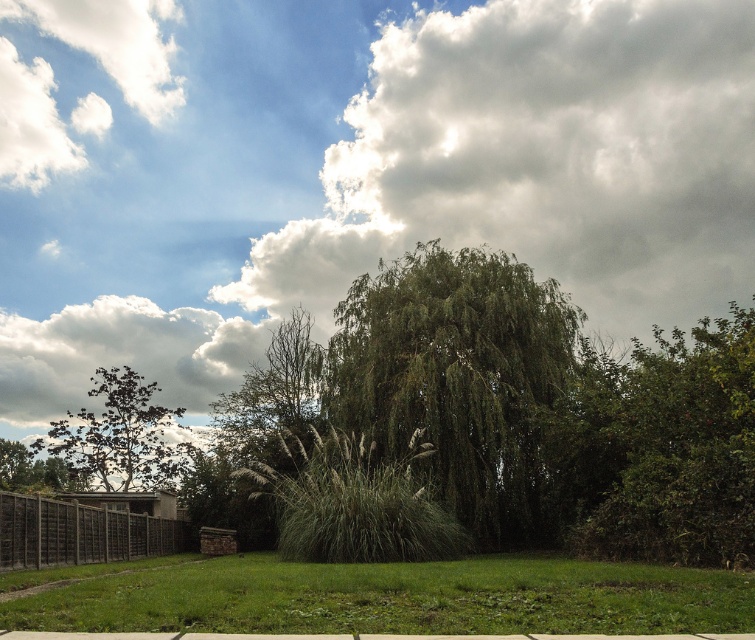
Can you confirm if cloudy sky at upper center is bigger than wooden fence at lower left?

Correct, cloudy sky at upper center is larger in size than wooden fence at lower left.

The image size is (755, 640). I want to click on cloudy sky at upper center, so click(x=353, y=172).

Find the location of a particular element. The height and width of the screenshot is (640, 755). cloudy sky at upper center is located at coordinates (353, 172).

Where is `cloudy sky at upper center`? cloudy sky at upper center is located at coordinates (353, 172).

Looking at this image, between cloudy sky at upper center and green leafy bush at right, which one appears on the right side from the viewer's perspective?

Positioned to the right is green leafy bush at right.

In the scene shown: Who is more distant from viewer, (x=544, y=163) or (x=612, y=531)?

Point (x=544, y=163)

The image size is (755, 640). I want to click on cloudy sky at upper center, so click(x=353, y=172).

Between cloudy sky at upper center and green leafy tree at left, which one appears on the right side from the viewer's perspective?

cloudy sky at upper center

Between cloudy sky at upper center and green leafy tree at left, which one is positioned higher?

cloudy sky at upper center is above.

Looking at this image, who is more distant from viewer, (x=162, y=154) or (x=156, y=481)?

Positioned behind is point (x=162, y=154).

The image size is (755, 640). Find the location of `cloudy sky at upper center`. cloudy sky at upper center is located at coordinates (353, 172).